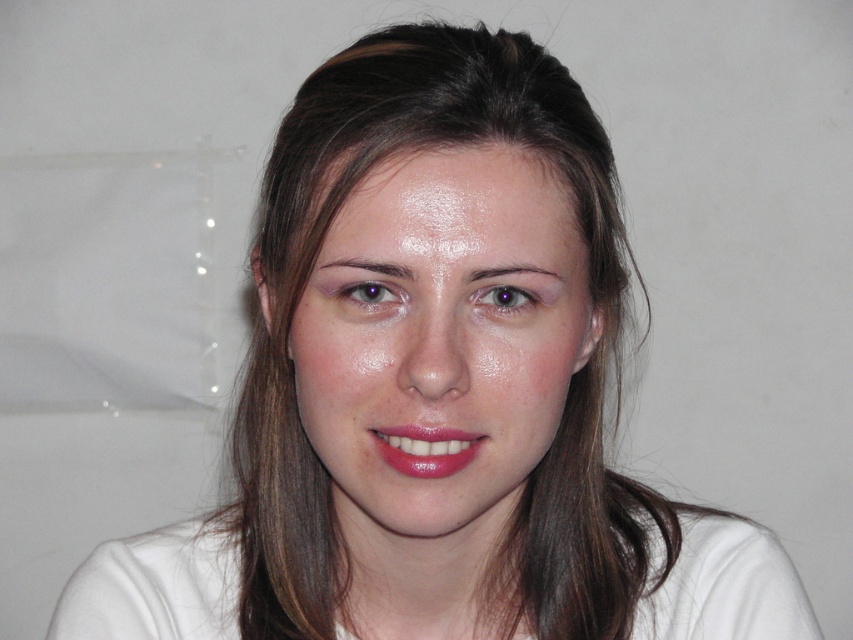
You are a makeup artist preparing for a photoshoot. You have two products in front of you on the table, the glossy matte lipstick at center and the purple glossy eye at center. The client wants to know which product is bigger. Which one should you point out?

The glossy matte lipstick at center is larger in size compared to the purple glossy eye at center, so you should point out the glossy matte lipstick at center.

You are a makeup artist preparing for a photoshoot. You have two items in front of you, the glossy matte lipstick at center and the matte skin eye at center. Which item is bigger?

The glossy matte lipstick at center is larger in size than the matte skin eye at center.

In the scene shown: You are a makeup artist preparing to apply lipstick. You have a glossy matte lipstick at center and need to ensure it aligns properly with the smooth skin face at center. Considering their heights, will the lipstick fit vertically on the face without needing adjustment?

The smooth skin face at center is taller than the glossy matte lipstick at center, so the lipstick will fit vertically on the face without needing adjustment.